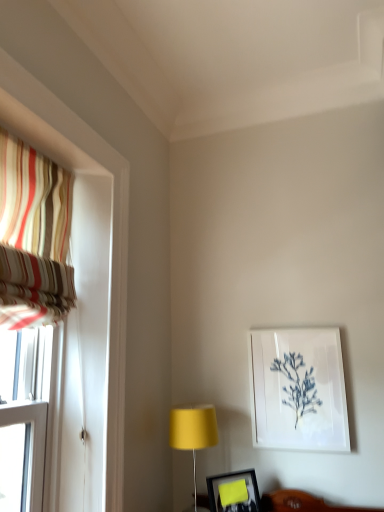
Question: In which direction should I rotate to look at matte black picture frame at lower center, the first picture frame positioned from the front?

Choices:
 (A) left
 (B) right

Answer: (B)

Question: Is white paper at upper right, which ranks as the second picture frame in left-to-right order, facing away from matte yellow lampshade at center?

Choices:
 (A) yes
 (B) no

Answer: (B)

Question: Is white paper at upper right, which is counted as the second picture frame, starting from the front, aimed at matte yellow lampshade at center?

Choices:
 (A) no
 (B) yes

Answer: (A)

Question: Considering the relative positions of white paper at upper right, which ranks as the second picture frame in left-to-right order, and matte yellow lampshade at center in the image provided, is white paper at upper right, which ranks as the second picture frame in left-to-right order, behind matte yellow lampshade at center?

Choices:
 (A) yes
 (B) no

Answer: (A)

Question: From the image's perspective, is white paper at upper right, acting as the 1th picture frame starting from the right, on matte yellow lampshade at center?

Choices:
 (A) no
 (B) yes

Answer: (B)

Question: Is matte yellow lampshade at center completely or partially inside white paper at upper right, acting as the 1th picture frame starting from the right?

Choices:
 (A) no
 (B) yes

Answer: (A)

Question: Does white paper at upper right, the second picture frame in the bottom-to-top sequence, have a lesser width compared to matte yellow lampshade at center?

Choices:
 (A) no
 (B) yes

Answer: (B)

Question: From a real-world perspective, does striped fabric curtain at left sit lower than white paper at upper right, the first picture frame from the back?

Choices:
 (A) no
 (B) yes

Answer: (A)

Question: Could you tell me if striped fabric curtain at left is turned towards white paper at upper right, acting as the 1th picture frame starting from the right?

Choices:
 (A) no
 (B) yes

Answer: (A)

Question: Are striped fabric curtain at left and white paper at upper right, which is counted as the second picture frame, starting from the front, far apart?

Choices:
 (A) no
 (B) yes

Answer: (B)

Question: Can you confirm if striped fabric curtain at left is taller than white paper at upper right, acting as the 1th picture frame starting from the right?

Choices:
 (A) no
 (B) yes

Answer: (B)

Question: Considering the relative sizes of striped fabric curtain at left and white paper at upper right, acting as the 1th picture frame starting from the right, in the image provided, is striped fabric curtain at left shorter than white paper at upper right, acting as the 1th picture frame starting from the right,?

Choices:
 (A) yes
 (B) no

Answer: (B)

Question: Does striped fabric curtain at left appear on the left side of white paper at upper right, the second picture frame in the bottom-to-top sequence?

Choices:
 (A) yes
 (B) no

Answer: (A)

Question: Considering the relative sizes of matte black picture frame at lower center, which is the 2th picture frame in top-to-bottom order, and white paper at upper right, acting as the 1th picture frame starting from the right, in the image provided, is matte black picture frame at lower center, which is the 2th picture frame in top-to-bottom order, bigger than white paper at upper right, acting as the 1th picture frame starting from the right,?

Choices:
 (A) yes
 (B) no

Answer: (B)